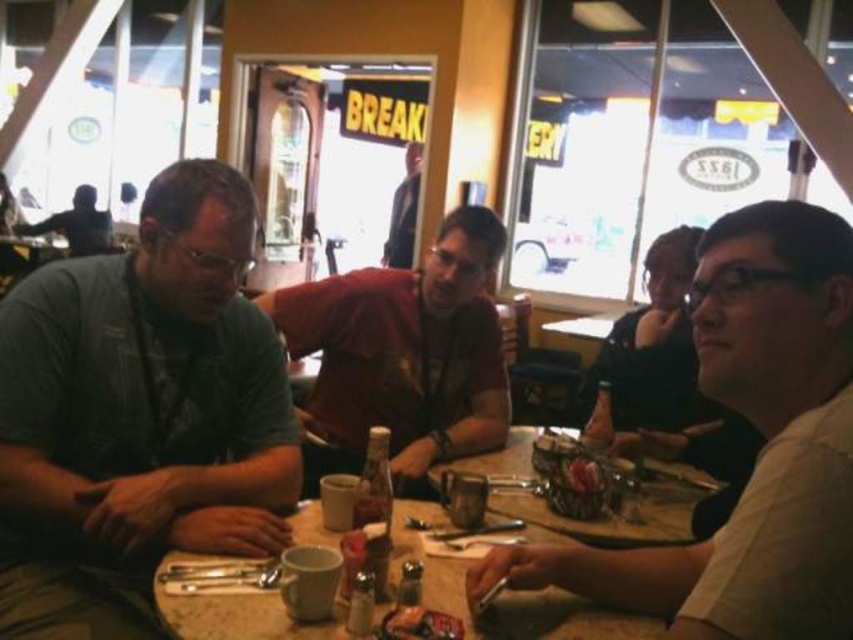
Question: In this image, where is wooden table at center located relative to matte black shirt at upper left?

Choices:
 (A) above
 (B) below

Answer: (B)

Question: Does wooden table at center have a smaller size compared to matte black shirt at upper left?

Choices:
 (A) yes
 (B) no

Answer: (A)

Question: In this image, where is matte red shirt at center located relative to dark blue shirt at center?

Choices:
 (A) right
 (B) left

Answer: (A)

Question: Estimate the real-world distances between objects in this image. Which object is farther from the matte red shirt at center?

Choices:
 (A) gray cotton shirt at left
 (B) wooden table at center

Answer: (A)

Question: Which point is closer to the camera?

Choices:
 (A) (798, 506)
 (B) (402, 180)
 (C) (312, 458)

Answer: (A)

Question: Based on their relative distances, which object is farther from the wooden table at center?

Choices:
 (A) shiny plastic fork at lower center
 (B) matte red shirt at center
 (C) white matte shirt at center
 (D) matte black shirt at upper left

Answer: (D)